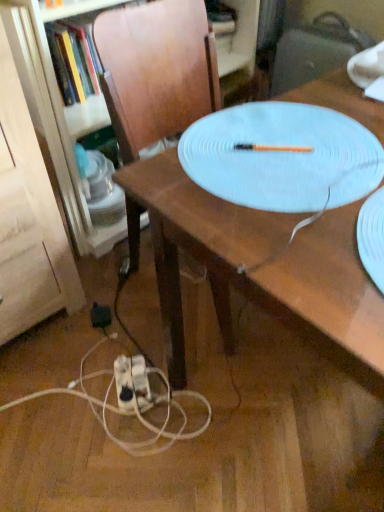
Question: Can white textured platter at center be found inside white plastic extension cord at lower center?

Choices:
 (A) no
 (B) yes

Answer: (A)

Question: Are white plastic extension cord at lower center and white textured platter at center far apart?

Choices:
 (A) no
 (B) yes

Answer: (A)

Question: Would you say white plastic extension cord at lower center is outside white textured platter at center?

Choices:
 (A) no
 (B) yes

Answer: (B)

Question: From the image's perspective, is white plastic extension cord at lower center below white textured platter at center?

Choices:
 (A) yes
 (B) no

Answer: (A)

Question: Considering the relative sizes of white plastic extension cord at lower center and white textured platter at center in the image provided, is white plastic extension cord at lower center wider than white textured platter at center?

Choices:
 (A) no
 (B) yes

Answer: (A)

Question: From the image's perspective, would you say white plastic extension cord at lower center is positioned over white textured platter at center?

Choices:
 (A) no
 (B) yes

Answer: (A)

Question: Is the depth of white plastic extension cord at lower center less than that of black plastic electric outlet at lower left?

Choices:
 (A) no
 (B) yes

Answer: (B)

Question: Can you confirm if white plastic extension cord at lower center is taller than black plastic electric outlet at lower left?

Choices:
 (A) yes
 (B) no

Answer: (A)

Question: Would you say black plastic electric outlet at lower left is part of white plastic extension cord at lower center's contents?

Choices:
 (A) no
 (B) yes

Answer: (A)

Question: From a real-world perspective, is white plastic extension cord at lower center beneath black plastic electric outlet at lower left?

Choices:
 (A) yes
 (B) no

Answer: (A)

Question: Could you tell me if white plastic extension cord at lower center is facing black plastic electric outlet at lower left?

Choices:
 (A) no
 (B) yes

Answer: (A)

Question: Is white plastic extension cord at lower center positioned with its back to black plastic electric outlet at lower left?

Choices:
 (A) yes
 (B) no

Answer: (B)

Question: Does wooden table at center have a lesser height compared to black plastic electric outlet at lower left?

Choices:
 (A) no
 (B) yes

Answer: (A)